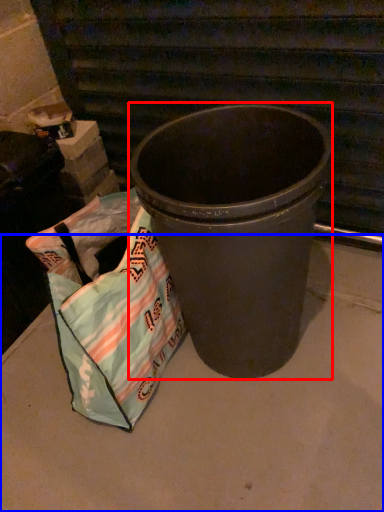
Question: Among these objects, which one is farthest to the camera, waste container (highlighted by a red box) or concrete (highlighted by a blue box)?

Choices:
 (A) waste container
 (B) concrete

Answer: (B)